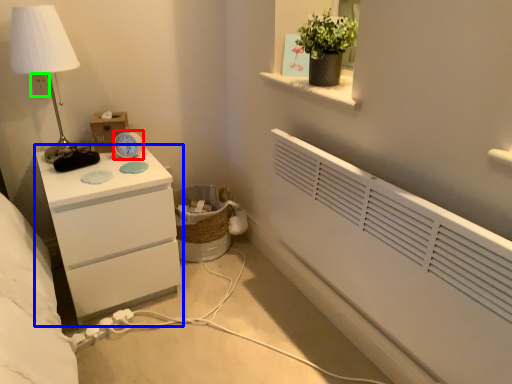
Question: Estimate the real-world distances between objects in this image. Which object is closer to alarm clock (highlighted by a red box), chest of drawers (highlighted by a blue box) or electric outlet (highlighted by a green box)?

Choices:
 (A) chest of drawers
 (B) electric outlet

Answer: (A)